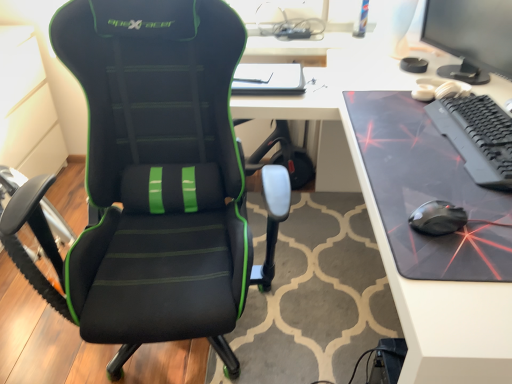
Where is `vacant space situated on the left part of black glossy mouse at right`? This screenshot has height=384, width=512. vacant space situated on the left part of black glossy mouse at right is located at coordinates (391, 221).